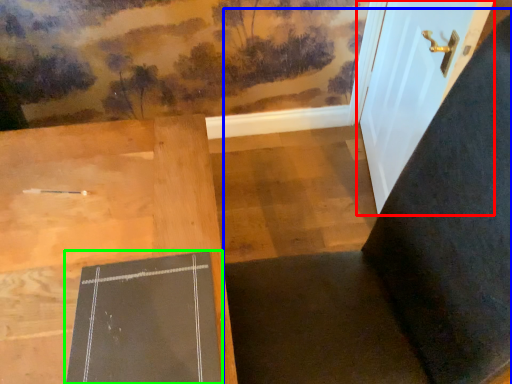
Question: Considering the real-world distances, which object is closest to door (highlighted by a red box)? chair (highlighted by a blue box) or bulletin board (highlighted by a green box).

Choices:
 (A) chair
 (B) bulletin board

Answer: (A)